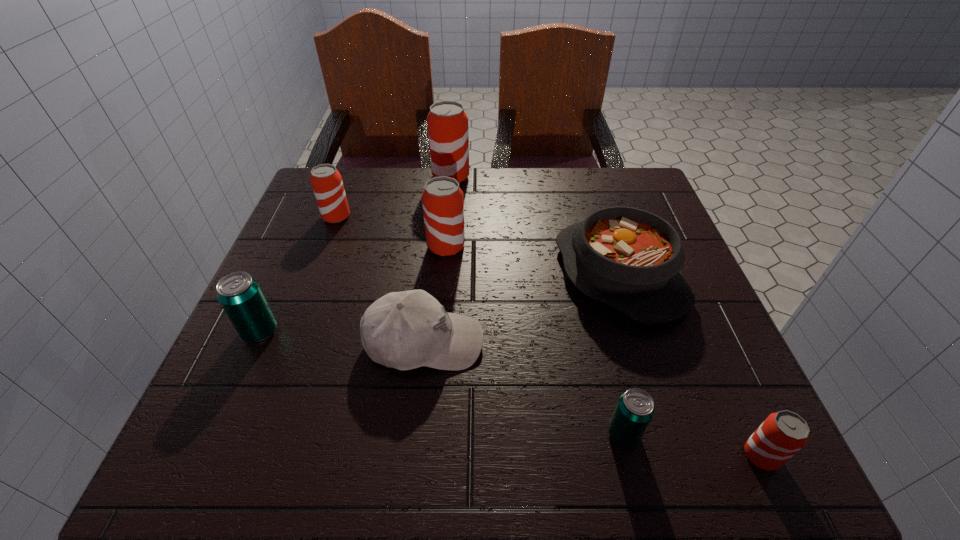
At what (x,y) coordinates should I click in order to perform the action: click on the nearer teal beer can. Please return your answer as a coordinate pair (x, y). Looking at the image, I should click on (635, 409).

Identify the location of the right teal beer can. (635, 409).

The height and width of the screenshot is (540, 960). Identify the location of the smallest orange beer can. (782, 434).

Where is `the rightmost orange beer can`? The width and height of the screenshot is (960, 540). the rightmost orange beer can is located at coordinates (x=782, y=434).

Where is `free space located on the right of the tallest object`? This screenshot has height=540, width=960. free space located on the right of the tallest object is located at coordinates (523, 177).

Find the location of `free location located on the front of the fifth shortest beer can`. free location located on the front of the fifth shortest beer can is located at coordinates (436, 375).

I want to click on vacant space located on the right of the second farthest beer can, so click(x=479, y=217).

In order to click on vacant space situated 0.310m on the right of the bigger teal beer can in this screenshot , I will do `click(441, 332)`.

You are a GUI agent. You are given a task and a screenshot of the screen. Output one action in this format:
    pyautogui.click(x=<x>, y=<y>)
    Task: Click on the free space located 0.260m on the left of the gray casserole
    
    Given the screenshot: What is the action you would take?
    pyautogui.click(x=439, y=274)

The width and height of the screenshot is (960, 540). Identify the location of free space located on the front-facing side of the baseball cap. (617, 342).